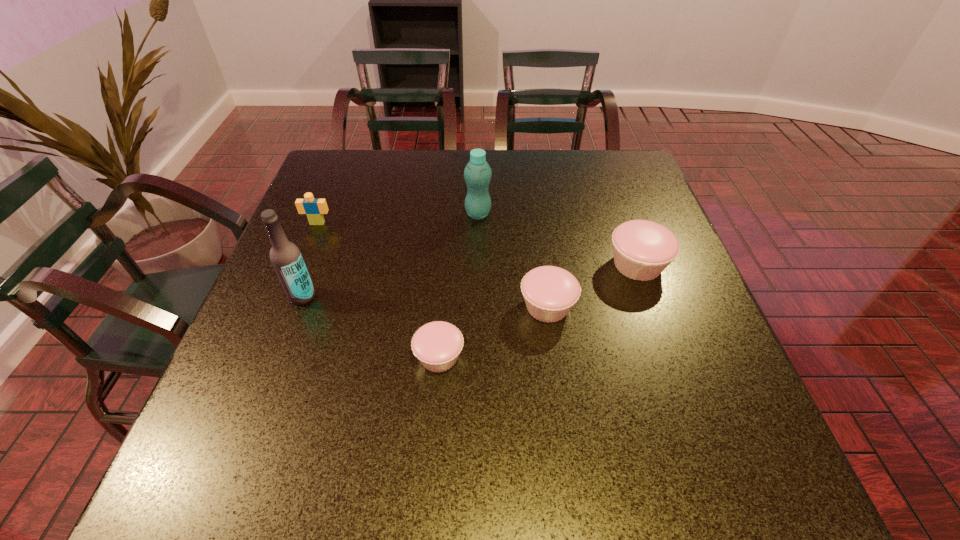
This screenshot has width=960, height=540. I want to click on free space at the left edge of the desktop, so click(x=260, y=318).

Locate an element on the screen. free space at the right edge is located at coordinates (679, 282).

This screenshot has width=960, height=540. Find the location of `free space at the far left corner of the desktop`. free space at the far left corner of the desktop is located at coordinates (317, 173).

Where is `free space at the near left corner`? Image resolution: width=960 pixels, height=540 pixels. free space at the near left corner is located at coordinates (258, 406).

Locate an element on the screen. vacant space at the far right corner is located at coordinates (634, 186).

At what (x,y) coordinates should I click in order to perform the action: click on free space at the near right corner of the desktop. Please return your answer as a coordinate pair (x, y). Looking at the image, I should click on coord(691,401).

Locate an element on the screen. This screenshot has width=960, height=540. unoccupied area between the water bottle and the shortest object is located at coordinates (459, 285).

You are a GUI agent. You are given a task and a screenshot of the screen. Output one action in this format:
    pyautogui.click(x=<x>, y=<y>)
    Task: Click on the vacant space that is in between the tallest cupcake and the second shortest object
    
    Given the screenshot: What is the action you would take?
    pyautogui.click(x=592, y=286)

You are a GUI agent. You are given a task and a screenshot of the screen. Output one action in this format:
    pyautogui.click(x=<x>, y=<y>)
    Task: Click on the empty space between the nearest object and the second tallest cupcake
    
    Given the screenshot: What is the action you would take?
    pyautogui.click(x=493, y=332)

You are a GUI agent. You are given a task and a screenshot of the screen. Output one action in this format:
    pyautogui.click(x=<x>, y=<y>)
    Task: Click on the vacant region between the nearest object and the second shortest cupcake
    The width and height of the screenshot is (960, 540).
    Given the screenshot: What is the action you would take?
    pyautogui.click(x=493, y=332)